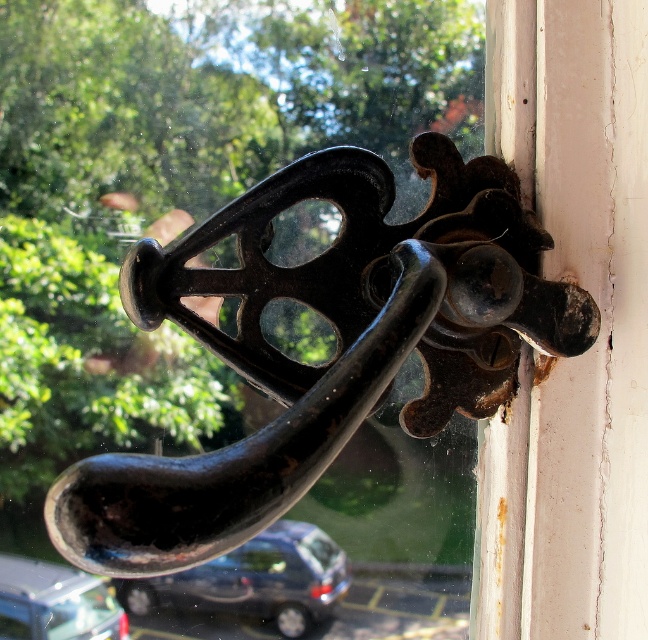
Where is `black cast iron handle at center`? This screenshot has width=648, height=640. black cast iron handle at center is located at coordinates (338, 346).

Which is more to the left, black cast iron handle at center or metallic silver car at lower left?

metallic silver car at lower left is more to the left.

What do you see at coordinates (338, 346) in the screenshot?
I see `black cast iron handle at center` at bounding box center [338, 346].

The width and height of the screenshot is (648, 640). I want to click on black cast iron handle at center, so click(x=338, y=346).

In the scene shown: Between black cast iron handle at center and shiny metallic car at lower center, which one has more height?

With more height is black cast iron handle at center.

Between black cast iron handle at center and shiny metallic car at lower center, which one appears on the right side from the viewer's perspective?

Positioned to the right is black cast iron handle at center.

Image resolution: width=648 pixels, height=640 pixels. What do you see at coordinates (338, 346) in the screenshot?
I see `black cast iron handle at center` at bounding box center [338, 346].

Where is `black cast iron handle at center`? The width and height of the screenshot is (648, 640). black cast iron handle at center is located at coordinates (338, 346).

Between point (318, 620) and point (119, 625), which one is positioned in front?

Point (119, 625) is in front.

Does shiny metallic car at lower center have a lesser height compared to metallic silver car at lower left?

Incorrect, shiny metallic car at lower center's height does not fall short of metallic silver car at lower left's.

Between point (279, 608) and point (65, 586), which one is positioned in front?

Point (65, 586) is more forward.

You are a GUI agent. You are given a task and a screenshot of the screen. Output one action in this format:
    pyautogui.click(x=<x>, y=<y>)
    Task: Click on the shiny metallic car at lower center
    The image size is (648, 640).
    Given the screenshot: What is the action you would take?
    pyautogui.click(x=255, y=580)